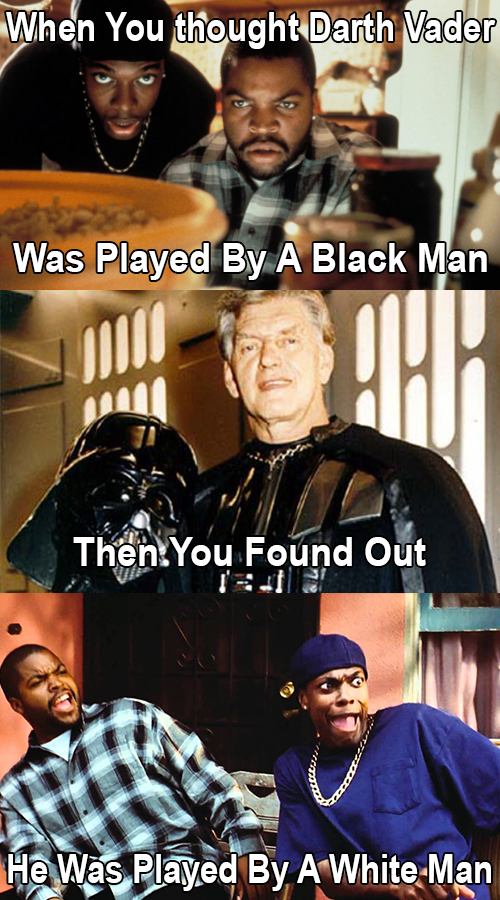
The image size is (500, 900). Find the location of `white wall`. white wall is located at coordinates (426, 104).